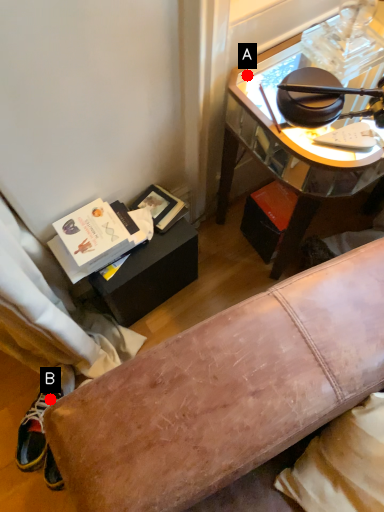
Question: Two points are circled on the image, labeled by A and B beside each circle. Among these points, which one is nearest to the camera?

Choices:
 (A) A is closer
 (B) B is closer

Answer: (A)